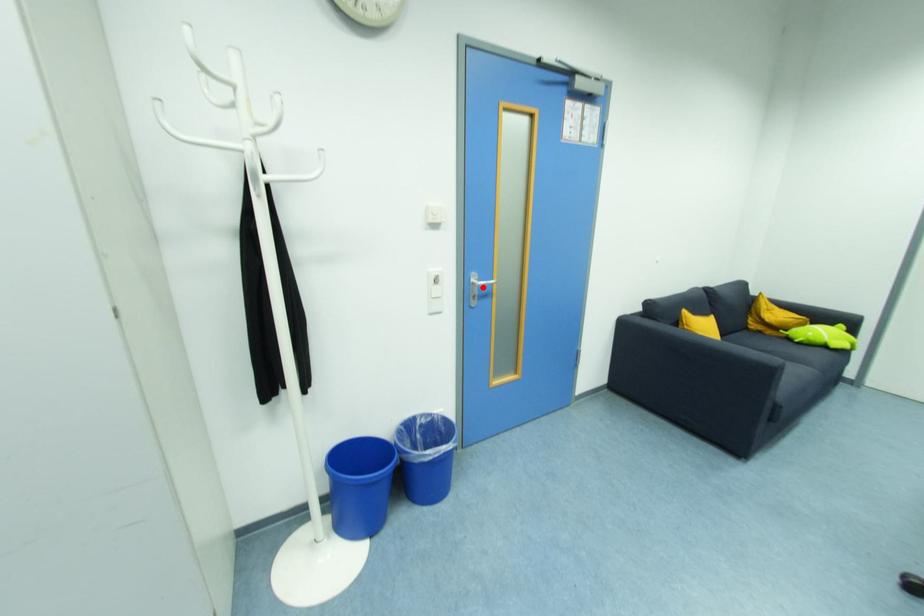
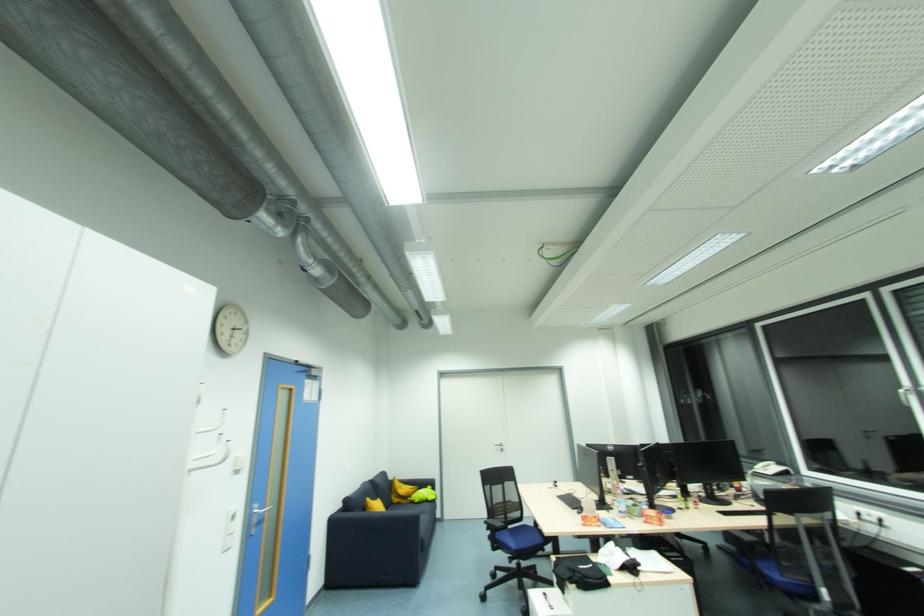
Where in the second image is the point corresponding to the highlighted location from the first image?

(261, 517)